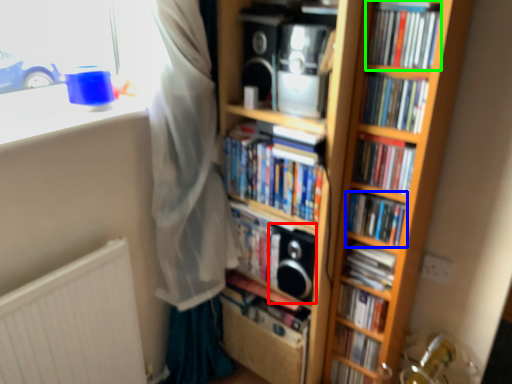
Question: Which object is the closest to the speaker (highlighted by a red box)? Choose among these: book (highlighted by a blue box) or book (highlighted by a green box).

Choices:
 (A) book
 (B) book

Answer: (A)